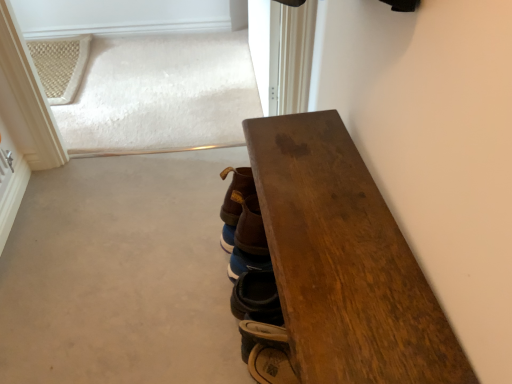
Question: Does brown leather boot at lower center, which ranks as the 2th footwear in top-to-bottom order, appear on the left side of wooden table at right?

Choices:
 (A) yes
 (B) no

Answer: (A)

Question: Is brown leather boot at lower center, which appears as the 1th footwear when ordered from the bottom, closer to the viewer compared to wooden table at right?

Choices:
 (A) no
 (B) yes

Answer: (A)

Question: Can you confirm if brown leather boot at lower center, which appears as the 1th footwear when ordered from the bottom, is wider than wooden table at right?

Choices:
 (A) no
 (B) yes

Answer: (A)

Question: Could you tell me if brown leather boot at lower center, which ranks as the 2th footwear in top-to-bottom order, is facing wooden table at right?

Choices:
 (A) no
 (B) yes

Answer: (A)

Question: Is wooden table at right inside brown leather boot at lower center, which ranks as the 2th footwear in top-to-bottom order?

Choices:
 (A) no
 (B) yes

Answer: (A)

Question: Relative to wooden table at right, is brown leather boot at center, marked as the 2th footwear in a bottom-to-top arrangement, in front or behind?

Choices:
 (A) behind
 (B) front

Answer: (A)

Question: Is brown leather boot at center, marked as the first footwear in a top-to-bottom arrangement, taller or shorter than wooden table at right?

Choices:
 (A) tall
 (B) short

Answer: (B)

Question: From the image's perspective, relative to wooden table at right, is brown leather boot at center, marked as the first footwear in a top-to-bottom arrangement, above or below?

Choices:
 (A) above
 (B) below

Answer: (A)

Question: From a real-world perspective, relative to wooden table at right, is brown leather boot at center, marked as the first footwear in a top-to-bottom arrangement, vertically above or below?

Choices:
 (A) above
 (B) below

Answer: (A)

Question: Considering the positions of point (291, 175) and point (230, 226), is point (291, 175) closer or farther from the camera than point (230, 226)?

Choices:
 (A) farther
 (B) closer

Answer: (B)

Question: Would you say wooden table at right is inside or outside brown leather boot at center, marked as the 2th footwear in a bottom-to-top arrangement?

Choices:
 (A) inside
 (B) outside

Answer: (B)

Question: In the image, is wooden table at right positioned in front of or behind brown leather boot at center, marked as the first footwear in a top-to-bottom arrangement?

Choices:
 (A) behind
 (B) front

Answer: (B)

Question: From a real-world perspective, is wooden table at right positioned above or below brown leather boot at center, marked as the first footwear in a top-to-bottom arrangement?

Choices:
 (A) below
 (B) above

Answer: (A)

Question: In terms of width, does wooden table at right look wider or thinner when compared to brown leather boot at lower center, which ranks as the 2th footwear in top-to-bottom order?

Choices:
 (A) thin
 (B) wide

Answer: (B)

Question: Considering the positions of wooden table at right and brown leather boot at lower center, which ranks as the 2th footwear in top-to-bottom order, in the image, is wooden table at right bigger or smaller than brown leather boot at lower center, which ranks as the 2th footwear in top-to-bottom order,?

Choices:
 (A) small
 (B) big

Answer: (B)